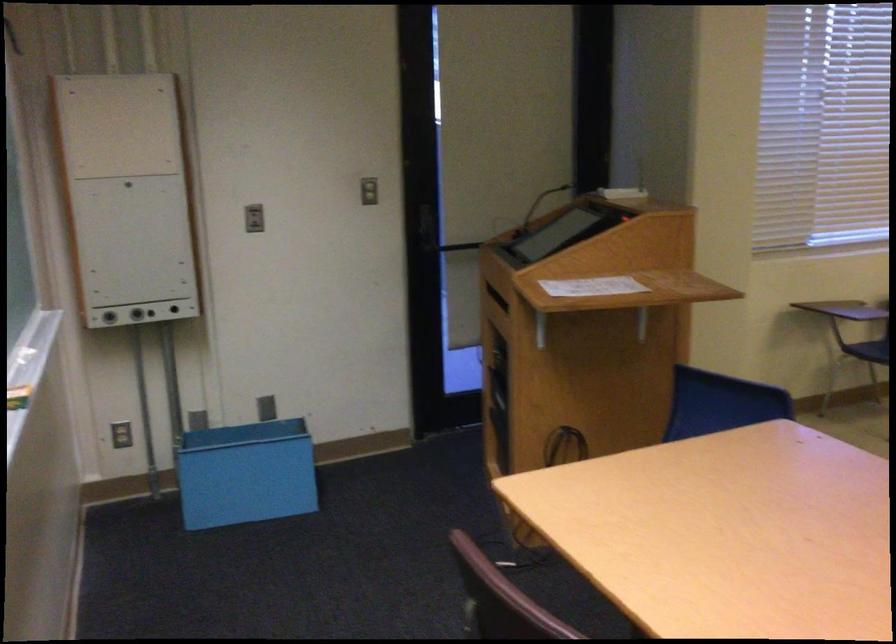
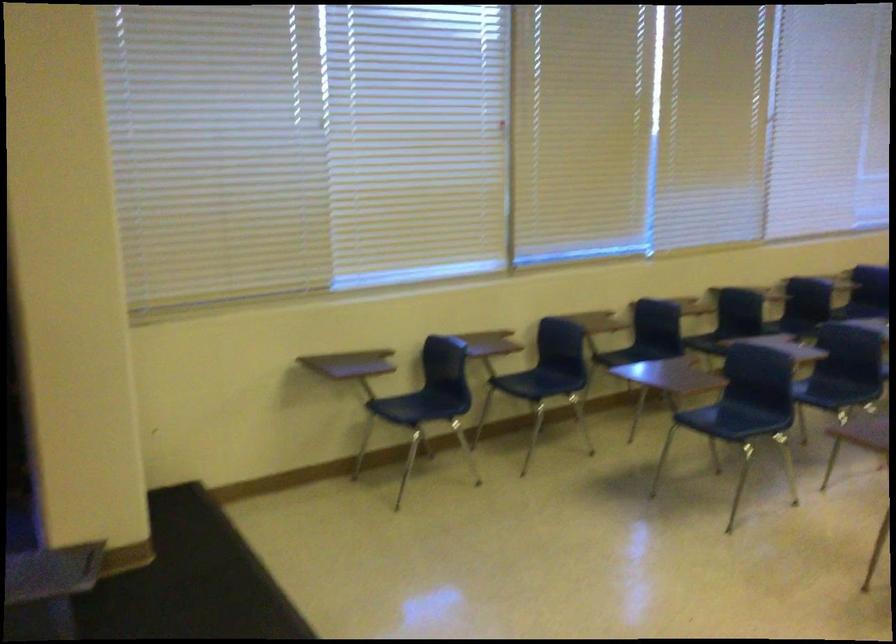
Question: Which direction would the cameraman need to move to produce the second image? Reply with the corresponding letter.

Choices:
 (A) Left
 (B) Right
 (C) Forward
 (D) Backward

Answer: (B)